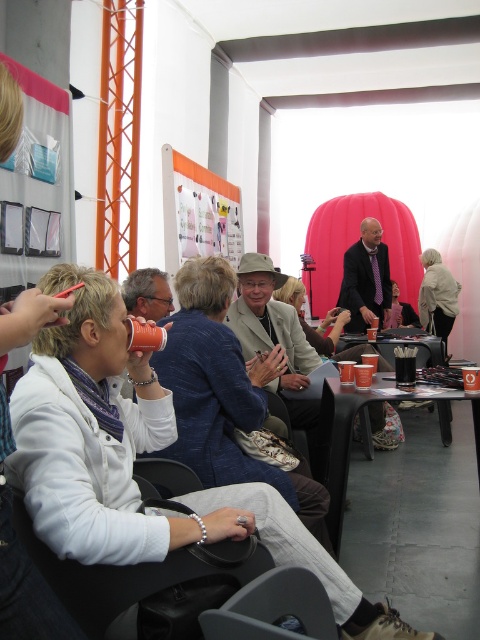
Question: Which point appears closest to the camera in this image?

Choices:
 (A) (149, 280)
 (B) (387, 428)
 (C) (152, 348)

Answer: (C)

Question: Which object is the farthest from the matte black jacket at center?

Choices:
 (A) white fabric bag at right
 (B) formal suit at center

Answer: (B)

Question: Can you confirm if formal suit at center is positioned to the right of matte beige jacket at center?

Choices:
 (A) yes
 (B) no

Answer: (A)

Question: Does matte beige jacket at center have a larger size compared to matte plastic cup at center?

Choices:
 (A) no
 (B) yes

Answer: (B)

Question: Is matte black glasses at center behind matte plastic cup at center?

Choices:
 (A) yes
 (B) no

Answer: (A)

Question: Considering the real-world distances, which object is farthest from the matte plastic cup at center?

Choices:
 (A) white fabric bag at right
 (B) black plastic cup at center
 (C) formal suit at center

Answer: (A)